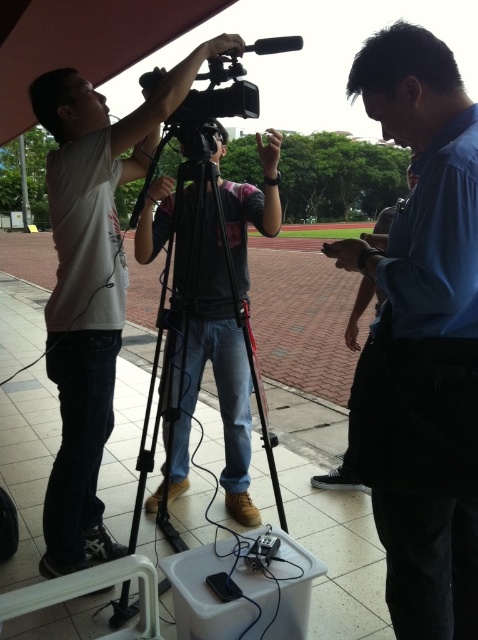
Question: Can you confirm if blue shirt at center is positioned below black matte tripod at center?

Choices:
 (A) no
 (B) yes

Answer: (B)

Question: Can you confirm if blue shirt at center is positioned above matte white shirt at upper left?

Choices:
 (A) no
 (B) yes

Answer: (A)

Question: Does blue shirt at center have a greater width compared to black matte tripod at center?

Choices:
 (A) no
 (B) yes

Answer: (A)

Question: Which object is closer to the camera taking this photo?

Choices:
 (A) blue shirt at center
 (B) matte white shirt at upper left

Answer: (A)

Question: Which of the following is the farthest from the observer?

Choices:
 (A) (154, 378)
 (B) (426, 323)

Answer: (A)

Question: Among these objects, which one is nearest to the camera?

Choices:
 (A) matte white shirt at upper left
 (B) blue shirt at center

Answer: (B)